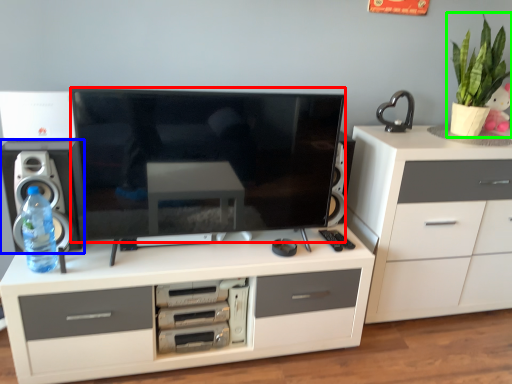
Question: Which object is the farthest from television (highlighted by a red box)? Choose among these: speaker (highlighted by a blue box) or houseplant (highlighted by a green box).

Choices:
 (A) speaker
 (B) houseplant

Answer: (B)